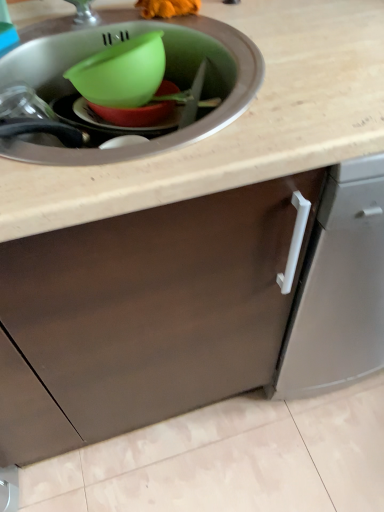
Question: Considering the positions of point (107, 109) and point (233, 91), is point (107, 109) closer or farther from the camera than point (233, 91)?

Choices:
 (A) closer
 (B) farther

Answer: (B)

Question: From the image's perspective, is green plastic bowl at center above or below matte green plastic sink at upper left?

Choices:
 (A) below
 (B) above

Answer: (B)

Question: Considering the positions of green plastic bowl at center and matte green plastic sink at upper left in the image, is green plastic bowl at center wider or thinner than matte green plastic sink at upper left?

Choices:
 (A) wide
 (B) thin

Answer: (B)

Question: Is matte green plastic sink at upper left taller or shorter than green plastic bowl at center?

Choices:
 (A) short
 (B) tall

Answer: (B)

Question: Considering the positions of matte green plastic sink at upper left and green plastic bowl at center in the image, is matte green plastic sink at upper left bigger or smaller than green plastic bowl at center?

Choices:
 (A) big
 (B) small

Answer: (A)

Question: From the image's perspective, relative to green plastic bowl at center, is matte green plastic sink at upper left above or below?

Choices:
 (A) above
 (B) below

Answer: (B)

Question: In the image, is matte green plastic sink at upper left on the left side or the right side of green plastic bowl at center?

Choices:
 (A) left
 (B) right

Answer: (A)